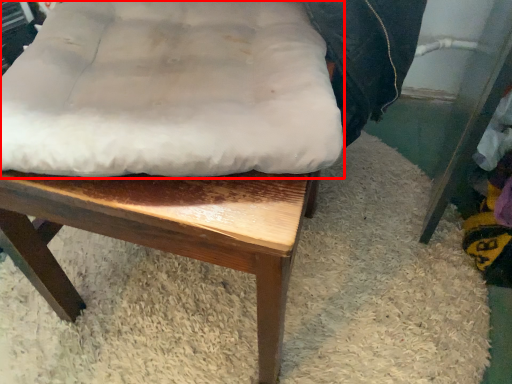
Question: From the image's perspective, where is sheet (annotated by the red box) located relative to chair?

Choices:
 (A) below
 (B) above

Answer: (B)